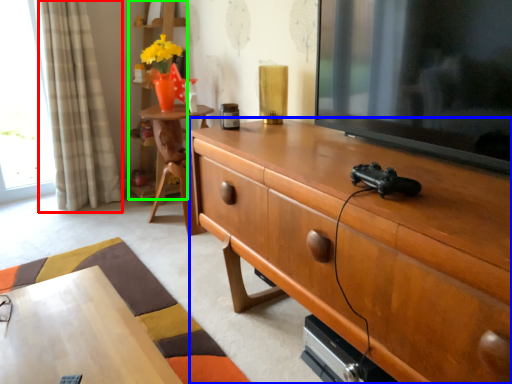
Question: Based on their relative distances, which object is nearer to curtain (highlighted by a red box)? Choose from cabinetry (highlighted by a blue box) and bookshelf (highlighted by a green box).

Choices:
 (A) cabinetry
 (B) bookshelf

Answer: (B)